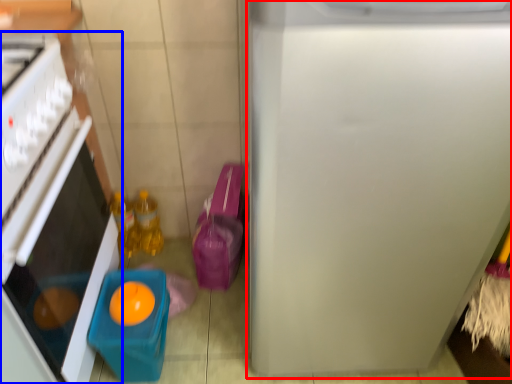
Question: Which object appears farthest to the camera in this image, refrigerator (highlighted by a red box) or home appliance (highlighted by a blue box)?

Choices:
 (A) refrigerator
 (B) home appliance

Answer: (B)